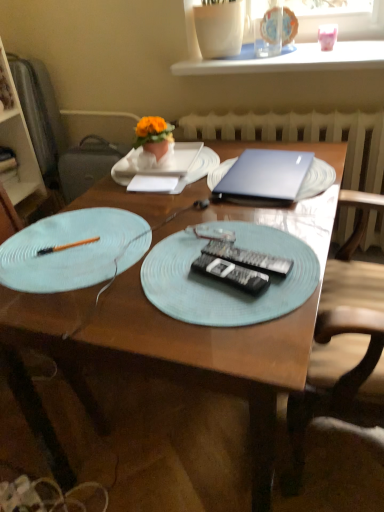
Where is `vacant area that lies between black plastic remote control at center, placed as the 2th remote control when sorted from bottom to top, and white paper at center`? The image size is (384, 512). vacant area that lies between black plastic remote control at center, placed as the 2th remote control when sorted from bottom to top, and white paper at center is located at coordinates (198, 221).